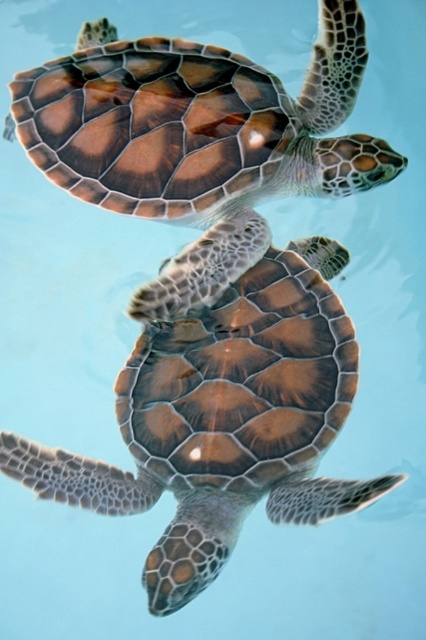
Is brown textured shell at center in front of brown textured shell at upper center?

Yes, it is.

Is brown textured shell at center to the left of brown textured shell at upper center from the viewer's perspective?

No, brown textured shell at center is not to the left of brown textured shell at upper center.

This screenshot has width=426, height=640. What do you see at coordinates (222, 419) in the screenshot? I see `brown textured shell at center` at bounding box center [222, 419].

Image resolution: width=426 pixels, height=640 pixels. Find the location of `brown textured shell at center`. brown textured shell at center is located at coordinates (222, 419).